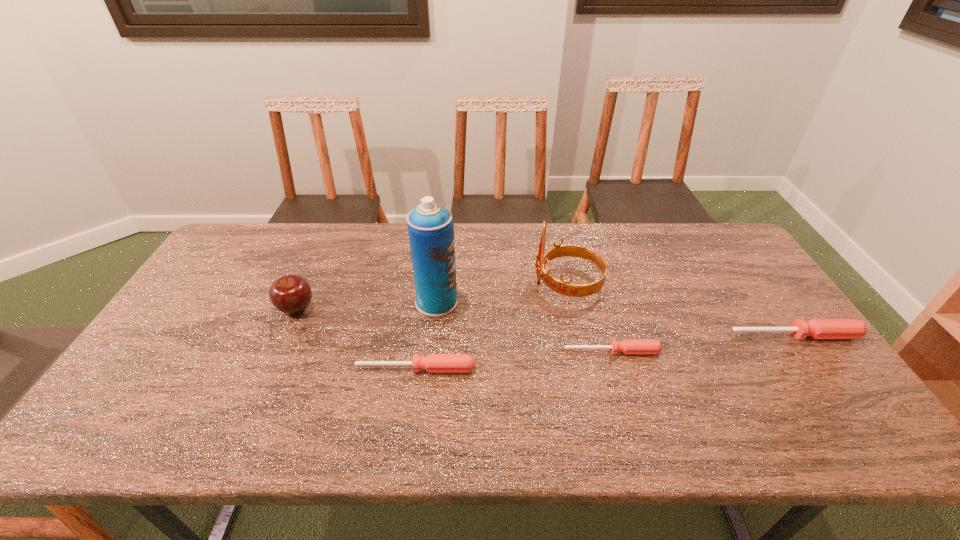
Locate an element on the screen. empty location between the second tallest object and the rightmost screwdriver is located at coordinates click(x=681, y=309).

Identify the location of unoccupied area between the aerosol can and the tiara. The height and width of the screenshot is (540, 960). [502, 293].

The width and height of the screenshot is (960, 540). In order to click on free space between the tiara and the rightmost object in this screenshot , I will do `click(681, 309)`.

Where is `free space between the nearest screwdriver and the apple`? The height and width of the screenshot is (540, 960). free space between the nearest screwdriver and the apple is located at coordinates (356, 338).

This screenshot has height=540, width=960. In order to click on unoccupied area between the rightmost object and the second screwdriver from right to left in this screenshot , I will do `click(703, 343)`.

Identify the location of object that stands as the fifth closest to the farthest screwdriver. (291, 294).

Identify the location of object that stands as the third closest to the second tallest object. This screenshot has width=960, height=540. (433, 363).

Identify which screwdriver is located as the second nearest to the tallest object. Please provide its 2D coordinates. Your answer should be formatted as a tuple, i.e. [(x, y)], where the tuple contains the x and y coordinates of a point satisfying the conditions above.

[(626, 346)]

You are a GUI agent. You are given a task and a screenshot of the screen. Output one action in this format:
    pyautogui.click(x=<x>, y=<y>)
    Task: Click on the second closest screwdriver to the second shortest object
    
    Given the screenshot: What is the action you would take?
    pyautogui.click(x=816, y=328)

Find the location of a particular element. free space that satisfies the following two spatial constraints: 1. on the back side of the second nearest object; 2. on the front-facing side of the tiara is located at coordinates (592, 284).